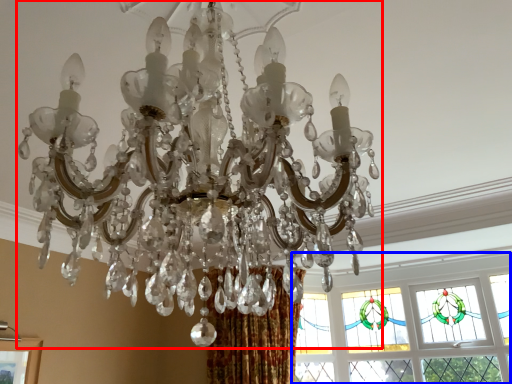
Question: Which point is further to the camera, lamp (highlighted by a red box) or window (highlighted by a blue box)?

Choices:
 (A) lamp
 (B) window

Answer: (B)